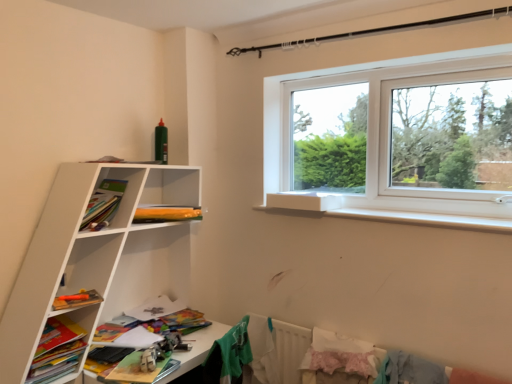
Question: Is wooden toy car at lower left positioned behind white matte bookshelf at lower left, marked as the 2th shelf in a top-to-bottom arrangement?

Choices:
 (A) yes
 (B) no

Answer: (A)

Question: Is wooden toy car at lower left facing towards white matte bookshelf at lower left, the first shelf from the bottom?

Choices:
 (A) yes
 (B) no

Answer: (B)

Question: Is wooden toy car at lower left shorter than white matte bookshelf at lower left, marked as the 2th shelf in a top-to-bottom arrangement?

Choices:
 (A) no
 (B) yes

Answer: (B)

Question: Is wooden toy car at lower left outside white matte bookshelf at lower left, the first shelf from the bottom?

Choices:
 (A) yes
 (B) no

Answer: (A)

Question: Does wooden toy car at lower left have a greater width compared to white matte bookshelf at lower left, marked as the 2th shelf in a top-to-bottom arrangement?

Choices:
 (A) no
 (B) yes

Answer: (B)

Question: Is there a large distance between wooden toy car at lower left and white matte bookshelf at lower left, marked as the 2th shelf in a top-to-bottom arrangement?

Choices:
 (A) no
 (B) yes

Answer: (A)

Question: Can you confirm if light blue fabric at lower right, which ranks as the first clothing in right-to-left order, is positioned to the right of matte orange pencil case at upper left, which is the 2th book in front-to-back order?

Choices:
 (A) no
 (B) yes

Answer: (B)

Question: Considering the relative positions of light blue fabric at lower right, marked as the third clothing in a left-to-right arrangement, and matte orange pencil case at upper left, which is the 2th book in front-to-back order, in the image provided, is light blue fabric at lower right, marked as the third clothing in a left-to-right arrangement, behind matte orange pencil case at upper left, which is the 2th book in front-to-back order,?

Choices:
 (A) no
 (B) yes

Answer: (A)

Question: Considering the relative positions of light blue fabric at lower right, which ranks as the first clothing in right-to-left order, and matte orange pencil case at upper left, which is the 1th book from back to front, in the image provided, is light blue fabric at lower right, which ranks as the first clothing in right-to-left order, in front of matte orange pencil case at upper left, which is the 1th book from back to front,?

Choices:
 (A) no
 (B) yes

Answer: (B)

Question: Is light blue fabric at lower right, marked as the third clothing in a left-to-right arrangement, oriented away from matte orange pencil case at upper left, the 2th book in the bottom-to-top sequence?

Choices:
 (A) yes
 (B) no

Answer: (B)

Question: From a real-world perspective, is light blue fabric at lower right, marked as the third clothing in a left-to-right arrangement, located beneath matte orange pencil case at upper left, which appears as the second book when viewed from the left?

Choices:
 (A) no
 (B) yes

Answer: (B)

Question: Are light blue fabric at lower right, which ranks as the first clothing in right-to-left order, and matte orange pencil case at upper left, which is the 1th book from back to front, far apart?

Choices:
 (A) yes
 (B) no

Answer: (A)

Question: Does matte orange pencil case at upper left, which is the 1th book from back to front, lie in front of green fabric shirt at lower center, which is the first clothing from left to right?

Choices:
 (A) no
 (B) yes

Answer: (A)